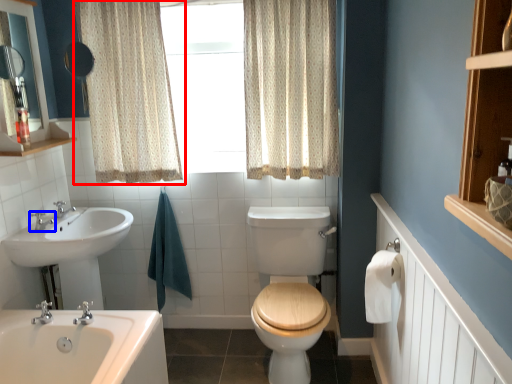
Question: Which of the following is the closest to the observer, curtain (highlighted by a red box) or tap (highlighted by a blue box)?

Choices:
 (A) curtain
 (B) tap

Answer: (A)